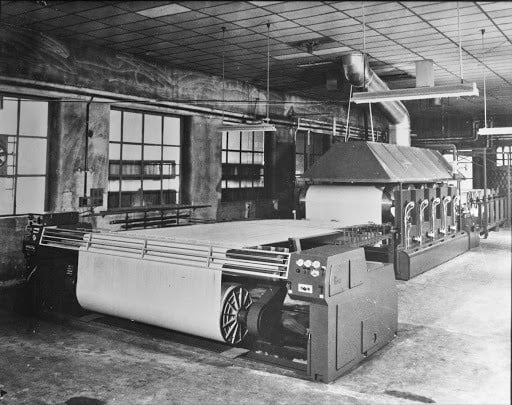
Image resolution: width=512 pixels, height=405 pixels. What are the coordinates of `window` in the screenshot? It's located at (26, 162), (150, 156), (238, 165), (305, 145), (465, 172), (500, 157).